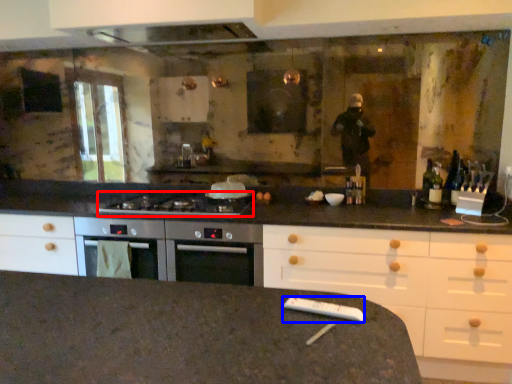
Question: Among these objects, which one is nearest to the camera, gas stove (highlighted by a red box) or appliance (highlighted by a blue box)?

Choices:
 (A) gas stove
 (B) appliance

Answer: (B)